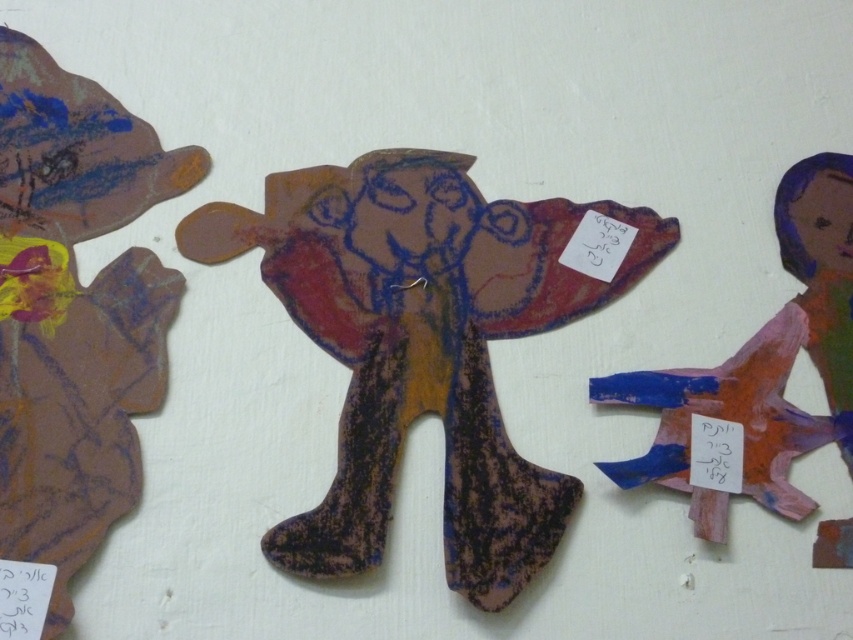
You are looking at the colorful paper cutouts on the wall. There are two points marked on the image. The first point is at coordinates point (419,172) and the second is at point (790,168). Which of these points is closer to you?

Point (419,172) is further to the camera than point (790,168). Therefore, the point closer to you is point (790,168).

You are a child looking at the colorful paper cutouts on the wall. There is a point marked at coordinates (422, 346). Which object is located at that point?

The point at coordinates (422, 346) is located at the matte brown paper doll at center.